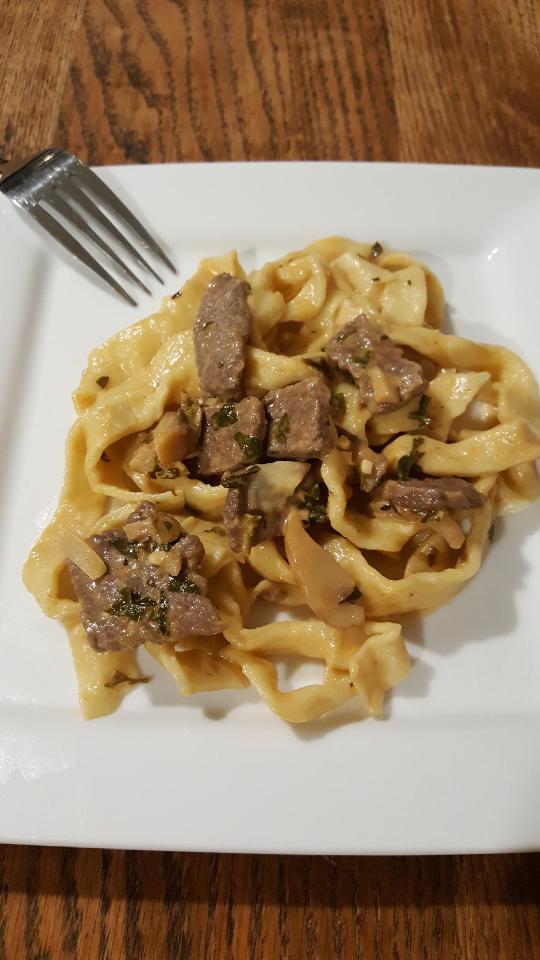
Locate an element on the screen. wood grains is located at coordinates (214, 914).